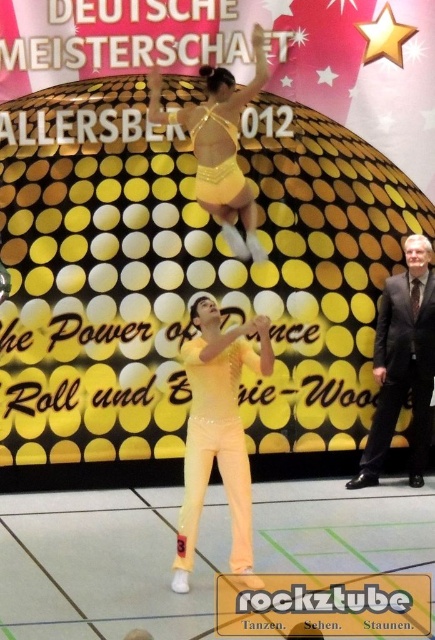
You are a photographer at the event. You need to capture a closeup of the yellow shiny dress at center. The camera is currently focused on point (x=220, y=147). Is the camera focused on the correct area?

Yes, the camera is focused on the correct area because the point (x=220, y=147) is on the yellow shiny dress at center.

You are a photographer at the event and want to capture a photo where both the dark gray suit at right and the yellow shiny dress at center are clearly visible. Given their sizes, which one might you need to position closer to the camera to ensure they appear equally sized in the photo?

The dark gray suit at right is narrower than the yellow shiny dress at center. To make them appear equally sized in the photo, you should position the dark gray suit at right closer to the camera since it is smaller in width.